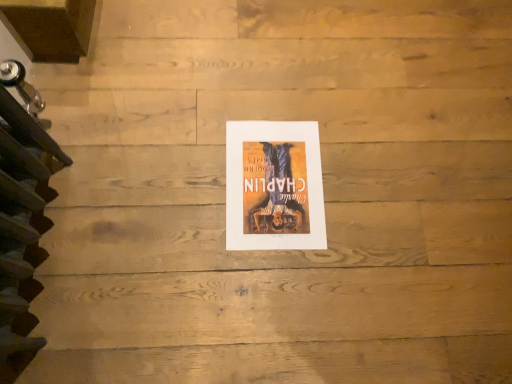
Measure the distance between point [1,147] and camera.

A distance of 66.80 centimeters exists between point [1,147] and camera.

Measure the distance between dark brown wooden stairs at left and camera.

26.24 inches.

Locate an element on the screen. The width and height of the screenshot is (512, 384). dark brown wooden stairs at left is located at coordinates (21, 223).

Describe the element at coordinates (21, 223) in the screenshot. This screenshot has width=512, height=384. I see `dark brown wooden stairs at left` at that location.

Where is `matte paper poster at center`? The height and width of the screenshot is (384, 512). matte paper poster at center is located at coordinates (274, 186).

The image size is (512, 384). What do you see at coordinates (274, 186) in the screenshot? I see `matte paper poster at center` at bounding box center [274, 186].

Where is `dark brown wooden stairs at left`? Image resolution: width=512 pixels, height=384 pixels. dark brown wooden stairs at left is located at coordinates (21, 223).

Based on their positions, is dark brown wooden stairs at left located to the left or right of matte paper poster at center?

dark brown wooden stairs at left is to the left of matte paper poster at center.

Considering the positions of objects dark brown wooden stairs at left and matte paper poster at center in the image provided, who is in front, dark brown wooden stairs at left or matte paper poster at center?

Positioned in front is dark brown wooden stairs at left.

Which is less distant, (x=28, y=221) or (x=258, y=146)?

Point (x=28, y=221).

From the image's perspective, is dark brown wooden stairs at left located above matte paper poster at center?

No.

From a real-world perspective, is dark brown wooden stairs at left positioned under matte paper poster at center based on gravity?

No, from a real-world perspective, dark brown wooden stairs at left is not under matte paper poster at center.

Looking at their sizes, would you say dark brown wooden stairs at left is wider or thinner than matte paper poster at center?

In the image, dark brown wooden stairs at left appears to be more narrow than matte paper poster at center.

Between dark brown wooden stairs at left and matte paper poster at center, which one has more height?

dark brown wooden stairs at left.

Looking at this image, is dark brown wooden stairs at left bigger than matte paper poster at center?

Indeed, dark brown wooden stairs at left has a larger size compared to matte paper poster at center.

Does dark brown wooden stairs at left contain matte paper poster at center?

No, matte paper poster at center is not inside dark brown wooden stairs at left.

Are dark brown wooden stairs at left and matte paper poster at center far apart?

They are positioned close to each other.

Is dark brown wooden stairs at left turned away from matte paper poster at center?

That's not correct — dark brown wooden stairs at left is not looking away from matte paper poster at center.

Identify the location of poster below the dark brown wooden stairs at left (from a real-world perspective). This screenshot has height=384, width=512. (274, 186).

Would you say matte paper poster at center is to the left or to the right of dark brown wooden stairs at left in the picture?

In the image, matte paper poster at center appears on the right side of dark brown wooden stairs at left.

Which is behind, matte paper poster at center or dark brown wooden stairs at left?

matte paper poster at center is further from the camera.

Between point (247, 153) and point (9, 334), which one is positioned in front?

Positioned in front is point (9, 334).

From the image's perspective, is matte paper poster at center positioned above or below dark brown wooden stairs at left?

matte paper poster at center is situated higher than dark brown wooden stairs at left in the image.

From a real-world perspective, is matte paper poster at center physically above dark brown wooden stairs at left?

No.

Between matte paper poster at center and dark brown wooden stairs at left, which one has smaller width?

dark brown wooden stairs at left.

Consider the image. Does matte paper poster at center have a greater height compared to dark brown wooden stairs at left?

No.

From the picture: Who is bigger, matte paper poster at center or dark brown wooden stairs at left?

Bigger between the two is dark brown wooden stairs at left.

Would you say dark brown wooden stairs at left is part of matte paper poster at center's contents?

No, dark brown wooden stairs at left is not inside matte paper poster at center.

Does matte paper poster at center touch dark brown wooden stairs at left?

matte paper poster at center and dark brown wooden stairs at left are clearly separated.

Is matte paper poster at center looking in the opposite direction of dark brown wooden stairs at left?

No, matte paper poster at center is not facing away from dark brown wooden stairs at left.

What's the angular difference between matte paper poster at center and dark brown wooden stairs at left's facing directions?

They differ by 89.4 degrees in their facing directions.

How far apart are matte paper poster at center and dark brown wooden stairs at left?

matte paper poster at center is 16.86 inches from dark brown wooden stairs at left.

Locate an element on the screen. Image resolution: width=512 pixels, height=384 pixels. stairwell that appears above the matte paper poster at center (from a real-world perspective) is located at coordinates (21, 223).

Find the location of `poster on the right of dark brown wooden stairs at left`. poster on the right of dark brown wooden stairs at left is located at coordinates (274, 186).

Where is `stairwell below the matte paper poster at center (from the image's perspective)`? This screenshot has width=512, height=384. stairwell below the matte paper poster at center (from the image's perspective) is located at coordinates pyautogui.click(x=21, y=223).